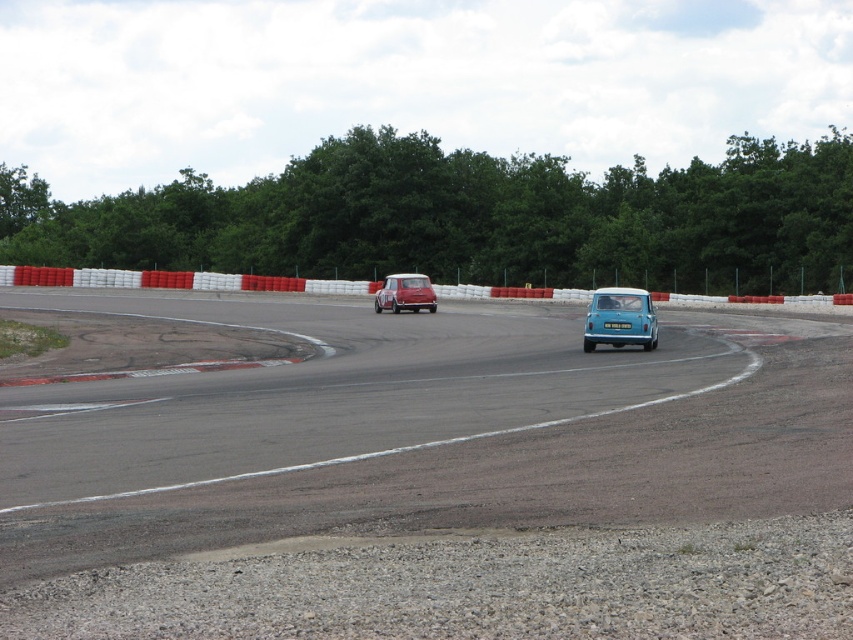
You are a race car driver preparing for a turn. You see the red plastic barrier at center and the matte blue car at center. How far apart are these two objects?

The red plastic barrier at center and the matte blue car at center are 108.53 feet apart.

You are a drone operator trying to capture aerial footage of the smooth asphalt race track at lower left. Your drone has a maximum flight range of 5 meters. Can your drone safely reach the track from its current position?

The distance between the smooth asphalt race track at lower left and the camera is 5.68 meters. Since the drone can only fly up to 5 meters, it cannot safely reach the track as the required distance exceeds its maximum range.